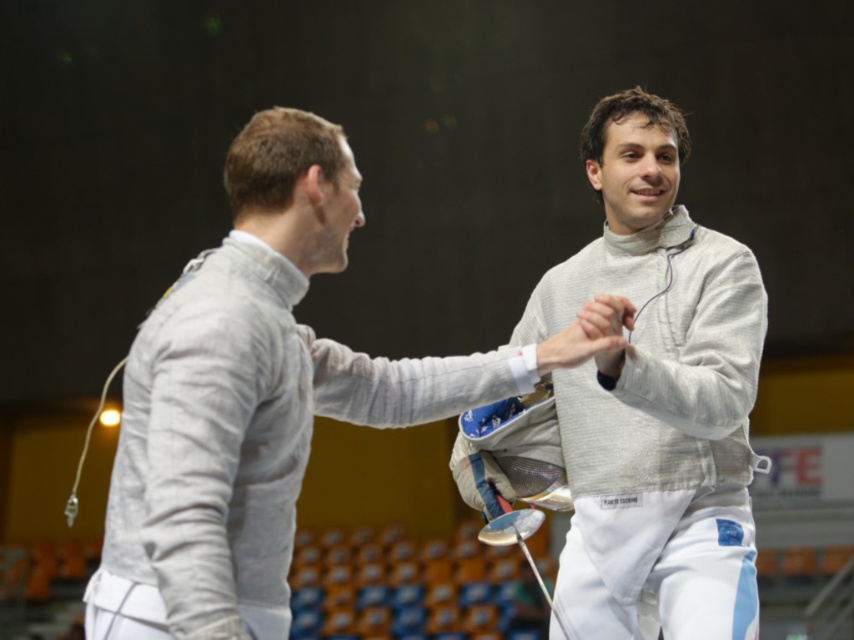
Question: Considering the relative positions of white fabric fencing uniform at left and white matte fencing uniform at center in the image provided, where is white fabric fencing uniform at left located with respect to white matte fencing uniform at center?

Choices:
 (A) right
 (B) left

Answer: (B)

Question: Is white fabric fencing uniform at left wider than white matte fencing uniform at center?

Choices:
 (A) yes
 (B) no

Answer: (A)

Question: Which of the following is the closest to the observer?

Choices:
 (A) white fabric fencing uniform at left
 (B) white matte fencing uniform at center

Answer: (A)

Question: Does white fabric fencing uniform at left appear under white matte fencing uniform at center?

Choices:
 (A) yes
 (B) no

Answer: (A)